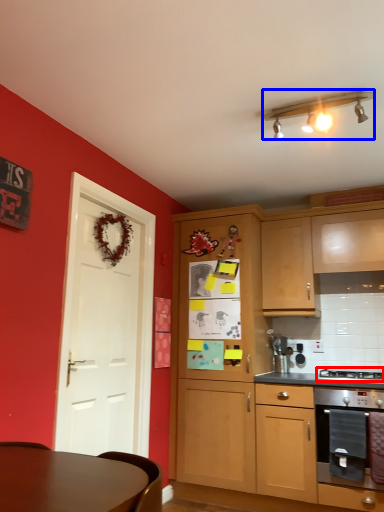
Question: Which of the following is the closest to the observer, gas stove (highlighted by a red box) or lamp (highlighted by a blue box)?

Choices:
 (A) gas stove
 (B) lamp

Answer: (B)